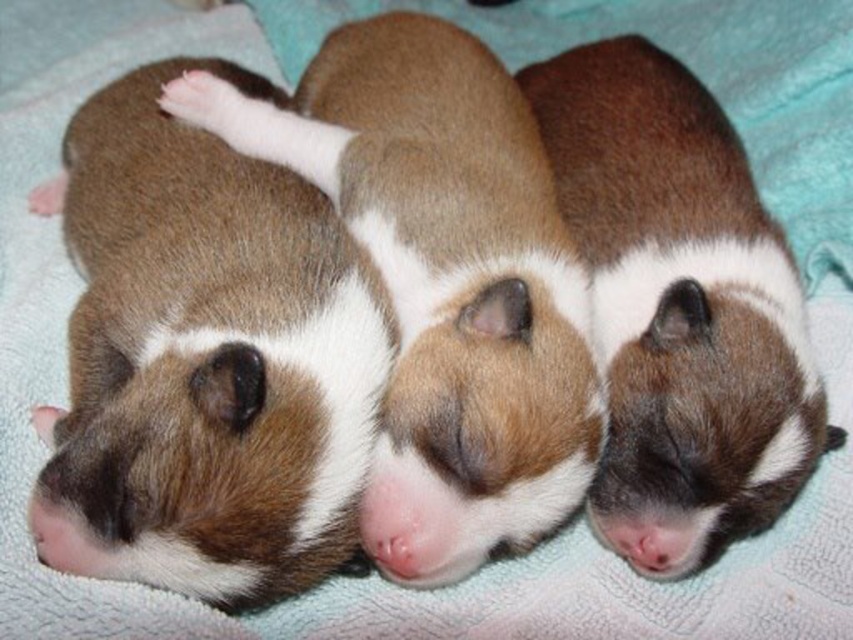
Is brown fur puppy at left below brown soft fur puppy at center?

Yes, brown fur puppy at left is below brown soft fur puppy at center.

Who is positioned more to the right, brown fur puppy at left or brown soft fur puppy at center?

brown soft fur puppy at center is more to the right.

What are the coordinates of `brown fur puppy at left` in the screenshot? It's located at (207, 360).

Measure the distance from brown fur puppy at left to brown fuzzy guinea pig at center.

A distance of 21.75 inches exists between brown fur puppy at left and brown fuzzy guinea pig at center.

Is point (82, 328) less distant than point (775, 236)?

Yes, it is.

The height and width of the screenshot is (640, 853). What do you see at coordinates (207, 360) in the screenshot?
I see `brown fur puppy at left` at bounding box center [207, 360].

Where is `brown fur puppy at left`? brown fur puppy at left is located at coordinates (207, 360).

Which is behind, point (358, 221) or point (704, 452)?

The point (358, 221) is more distant.

Which of these two, brown soft fur puppy at center or brown fuzzy guinea pig at center, stands shorter?

brown fuzzy guinea pig at center is shorter.

This screenshot has height=640, width=853. Describe the element at coordinates (444, 284) in the screenshot. I see `brown soft fur puppy at center` at that location.

Locate an element on the screen. Image resolution: width=853 pixels, height=640 pixels. brown soft fur puppy at center is located at coordinates (444, 284).